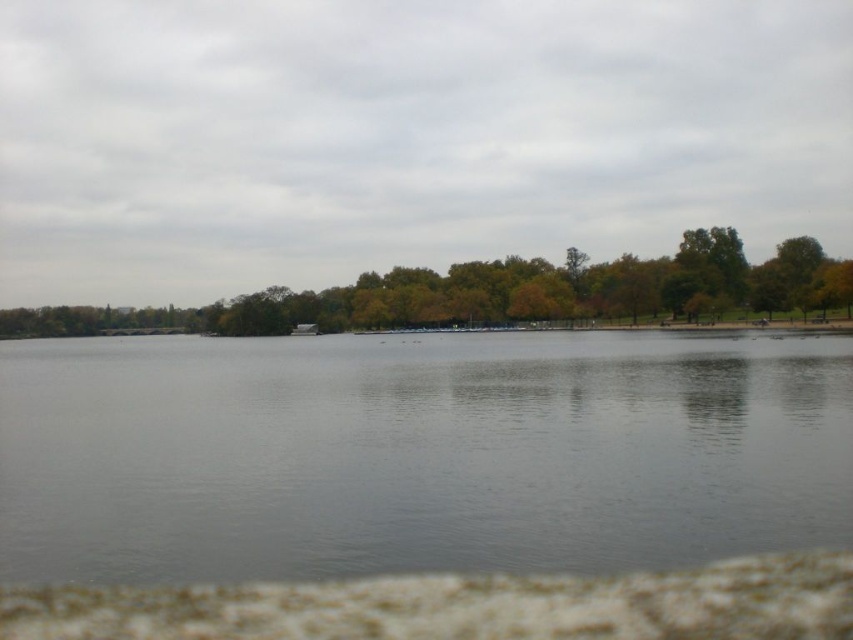
You are standing at the lakeside and want to take a photo of the gray water at center and the green leafy tree at center. Which object will appear larger in the photo?

The gray water at center will appear larger in the photo because it is closer to the viewer than the green leafy tree at center.

You are standing at the lakeside and want to take a photo of the gray water at center and the green leafy tree at center. Which object will appear closer to the bottom of your photo frame?

The gray water at center appears closer to the bottom of the photo frame because it is located below the green leafy tree at center.